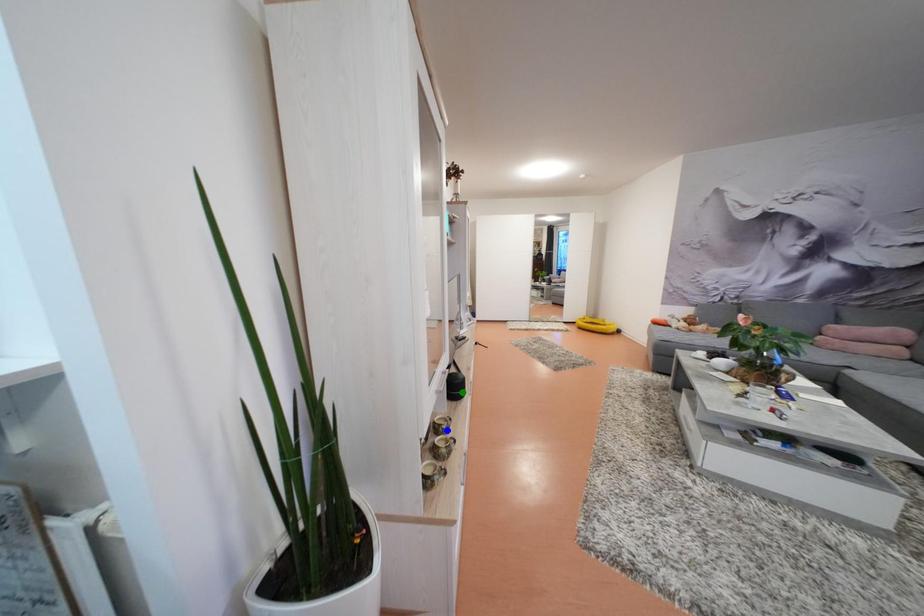
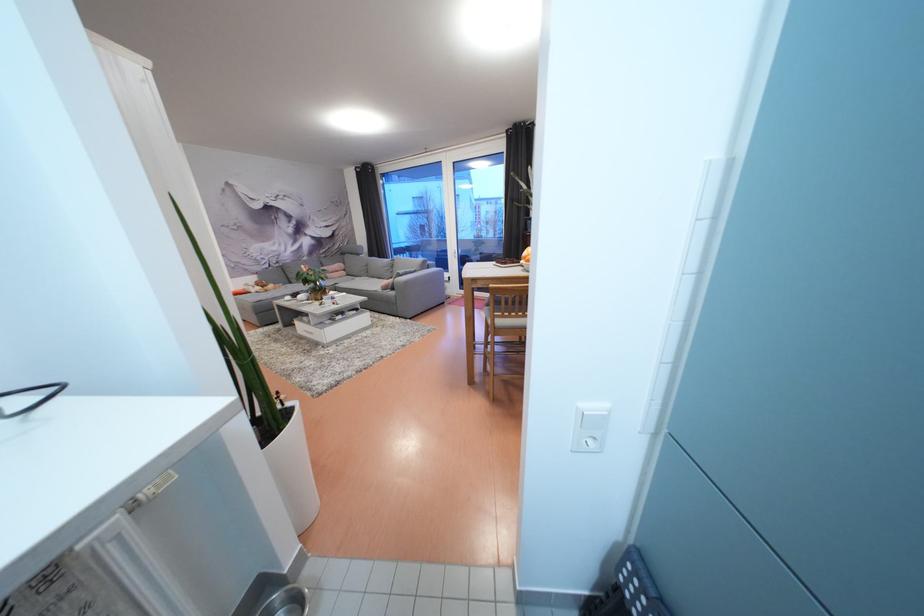
I am providing you with two images of the same scene from different viewpoints. Three points are marked in image1. Which point corresponds to a part or object that is occluded in image2?In image1, three points are marked. Which of them correspond to a part or object that is occluded in image2?Among the three points shown in image1, which one corresponds to a part or object that is no longer visible due to occlusion in image2?

blue point, yellow point, green point